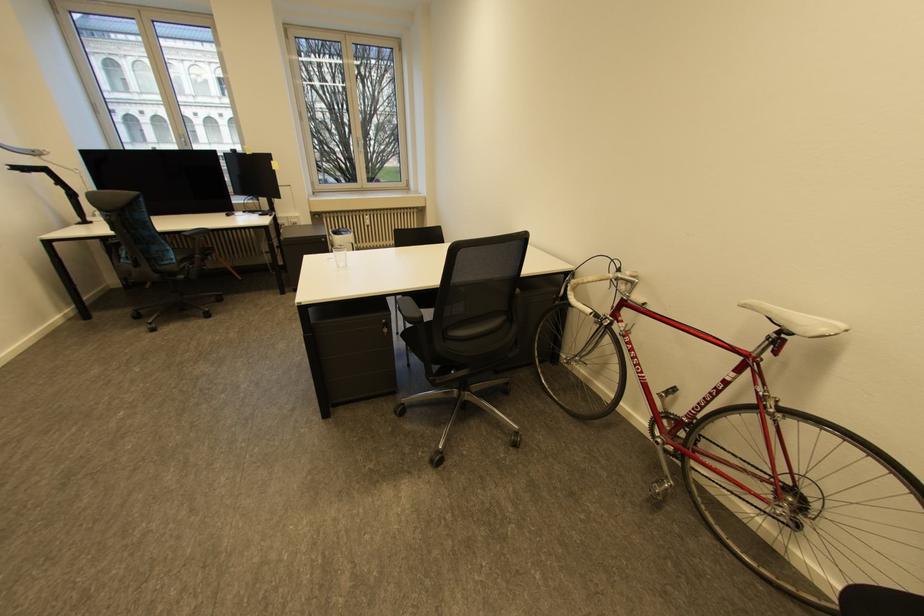
Find where to sit the black chair sitting surface. Please return your answer as a coordinate pair (x, y).

(419, 341)